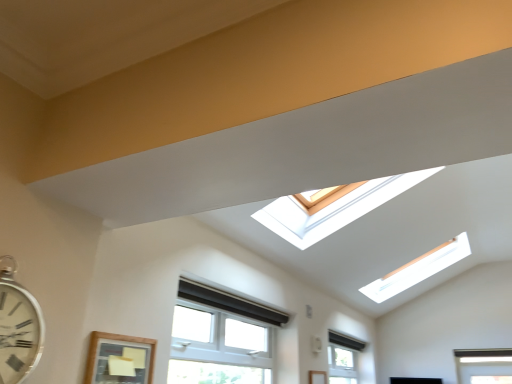
Question: Does wooden-framed window at lower left, which appears as the 3th window when viewed from the right, touch clear glass window at lower center, which is counted as the first window, starting from the back?

Choices:
 (A) no
 (B) yes

Answer: (A)

Question: Is clear glass window at lower center, which is counted as the first window, starting from the back, at the back of wooden-framed window at lower left, which appears as the 3th window when viewed from the right?

Choices:
 (A) yes
 (B) no

Answer: (B)

Question: From the image's perspective, is wooden-framed window at lower left, which ranks as the 1th window in front-to-back order, on top of clear glass window at lower center, the third window when ordered from left to right?

Choices:
 (A) no
 (B) yes

Answer: (B)

Question: From the image's perspective, does wooden-framed window at lower left, the third window when ordered from back to front, appear lower than clear glass window at lower center, which is counted as the first window, starting from the back?

Choices:
 (A) yes
 (B) no

Answer: (B)

Question: Is wooden-framed window at lower left, which appears as the 1th window when viewed from the left, taller than clear glass window at lower center, the 1th window viewed from the right?

Choices:
 (A) no
 (B) yes

Answer: (B)

Question: From a real-world perspective, is wooden-framed window at lower left, which appears as the 1th window when viewed from the left, positioned under clear glass window at lower center, the 1th window viewed from the right, based on gravity?

Choices:
 (A) no
 (B) yes

Answer: (B)

Question: Considering the relative sizes of white metallic clock at left and white plastic window at lower center, placed as the second window when sorted from left to right, in the image provided, is white metallic clock at left bigger than white plastic window at lower center, placed as the second window when sorted from left to right,?

Choices:
 (A) no
 (B) yes

Answer: (A)

Question: Does white metallic clock at left lie in front of white plastic window at lower center, which is the 2th window in back-to-front order?

Choices:
 (A) no
 (B) yes

Answer: (B)

Question: Does white metallic clock at left have a smaller size compared to white plastic window at lower center, the second window positioned from the front?

Choices:
 (A) yes
 (B) no

Answer: (A)

Question: From the image's perspective, is white metallic clock at left above white plastic window at lower center, the second window positioned from the front?

Choices:
 (A) yes
 (B) no

Answer: (A)

Question: Is there a large distance between white metallic clock at left and white plastic window at lower center, which is the 2th window in back-to-front order?

Choices:
 (A) yes
 (B) no

Answer: (A)

Question: Can we say white metallic clock at left lies outside white plastic window at lower center, marked as the 2th window in a right-to-left arrangement?

Choices:
 (A) yes
 (B) no

Answer: (A)

Question: Does wooden-framed window at lower left, which appears as the 3th window when viewed from the right, contain white metallic clock at left?

Choices:
 (A) yes
 (B) no

Answer: (B)